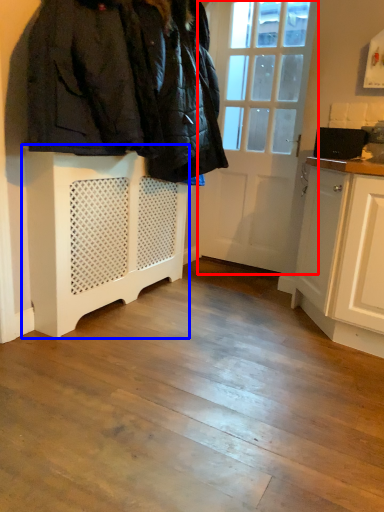
Question: Which of the following is the farthest to the observer, door (highlighted by a red box) or cabinetry (highlighted by a blue box)?

Choices:
 (A) door
 (B) cabinetry

Answer: (A)